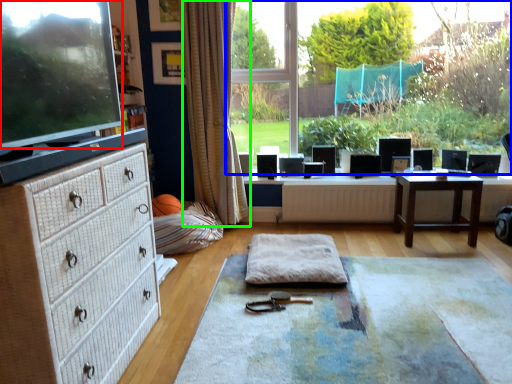
Question: Based on their relative distances, which object is farther from computer monitor (highlighted by a red box)? Choose from window (highlighted by a blue box) and curtain (highlighted by a green box).

Choices:
 (A) window
 (B) curtain

Answer: (A)